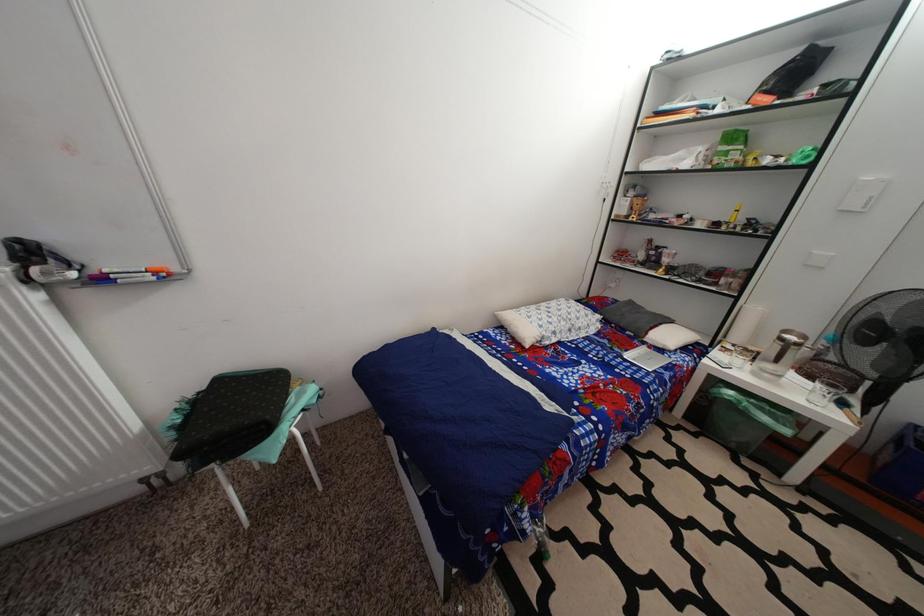
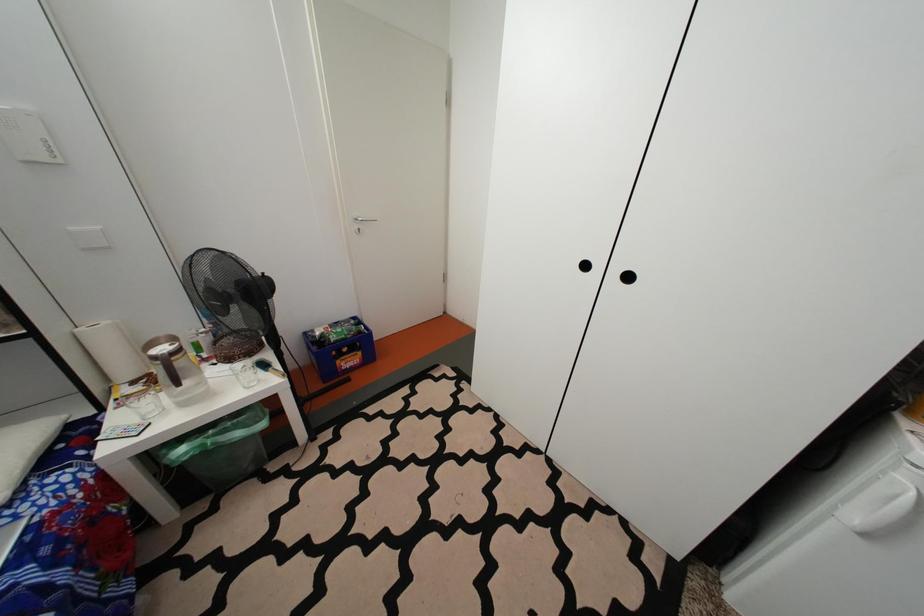
Based on the continuous images, in which direction is the camera rotating?

The rotation direction of the camera is right-down.